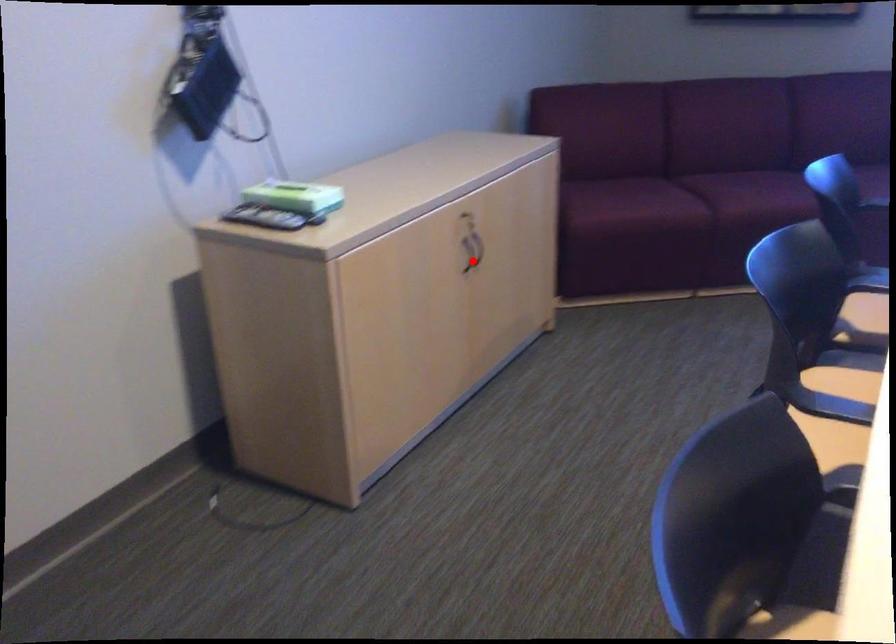
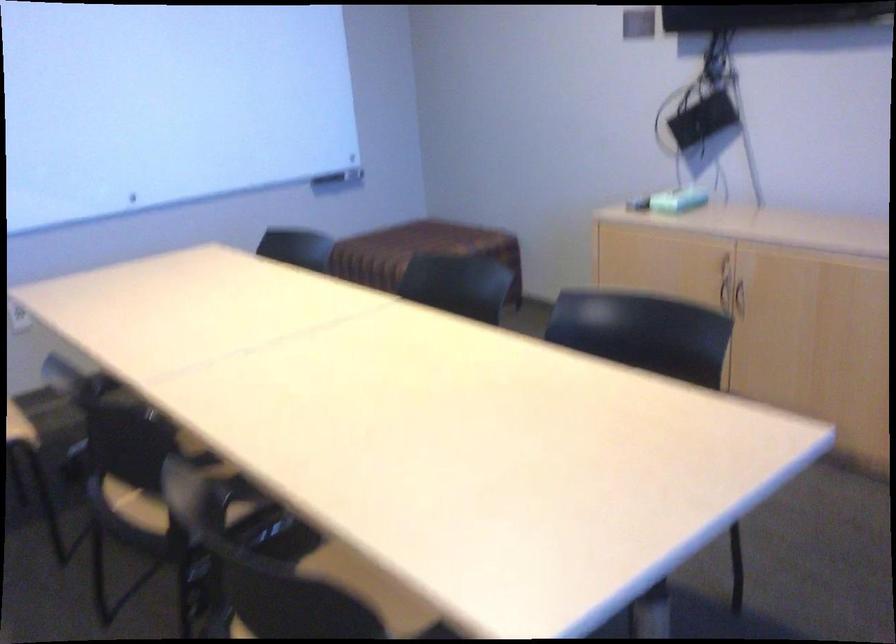
Question: I am providing you with two images of the same scene from different viewpoints. Image1 has a red point marked. In image2, the corresponding 3D location appears at what relative position? Reply with the corresponding letter.

Choices:
 (A) Closer
 (B) Farther

Answer: (B)